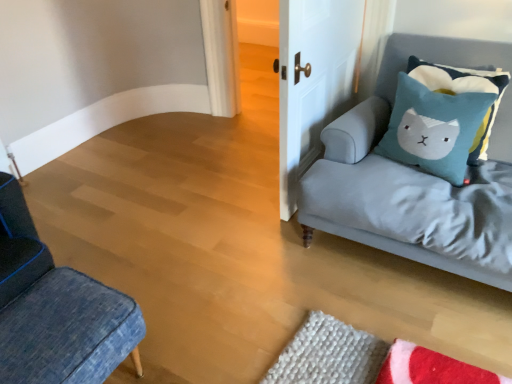
Question: Choose the correct answer: Is denim cushion at lower left inside blue felt pillow at upper right, acting as the second pillow starting from the right, or outside it?

Choices:
 (A) inside
 (B) outside

Answer: (B)

Question: Is denim cushion at lower left wider or thinner than blue felt pillow at upper right, which is counted as the first pillow, starting from the left?

Choices:
 (A) wide
 (B) thin

Answer: (A)

Question: Which is nearer to the light gray fabric couch at right?

Choices:
 (A) white matte door at upper center
 (B) teal felt pillow at upper right, which is counted as the first pillow, starting from the right
 (C) denim cushion at lower left
 (D) blue felt pillow at upper right, which is counted as the first pillow, starting from the left

Answer: (D)

Question: Considering the real-world distances, which object is farthest from the white matte door at upper center?

Choices:
 (A) teal felt pillow at upper right, which is counted as the 2th pillow, starting from the left
 (B) light gray fabric couch at right
 (C) denim cushion at lower left
 (D) blue felt pillow at upper right, which is counted as the first pillow, starting from the left

Answer: (C)